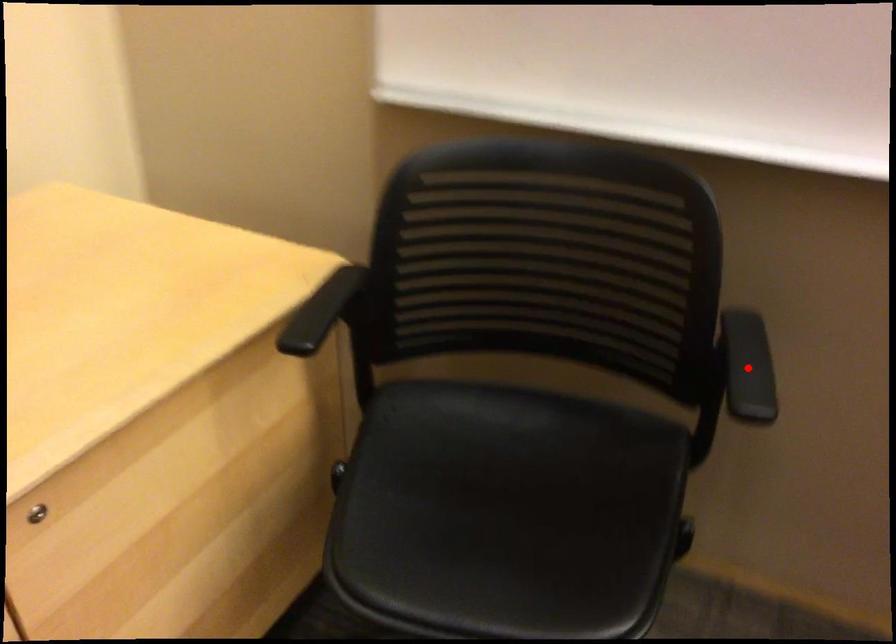
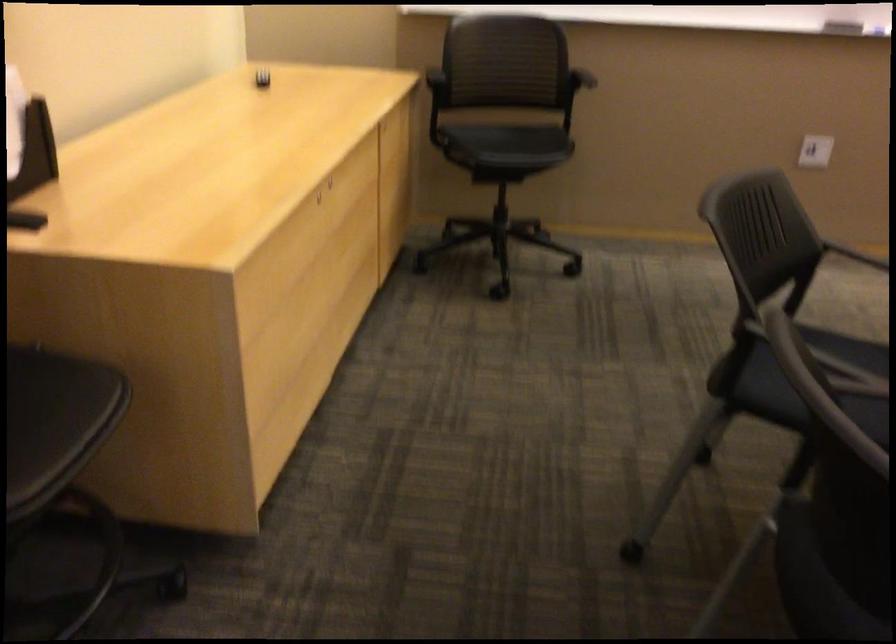
Question: I am providing you with two images of the same scene from different viewpoints. Image1 has a red point marked. In image2, the corresponding 3D location appears at what relative position? Reply with the corresponding letter.

Choices:
 (A) Closer
 (B) Farther

Answer: (B)